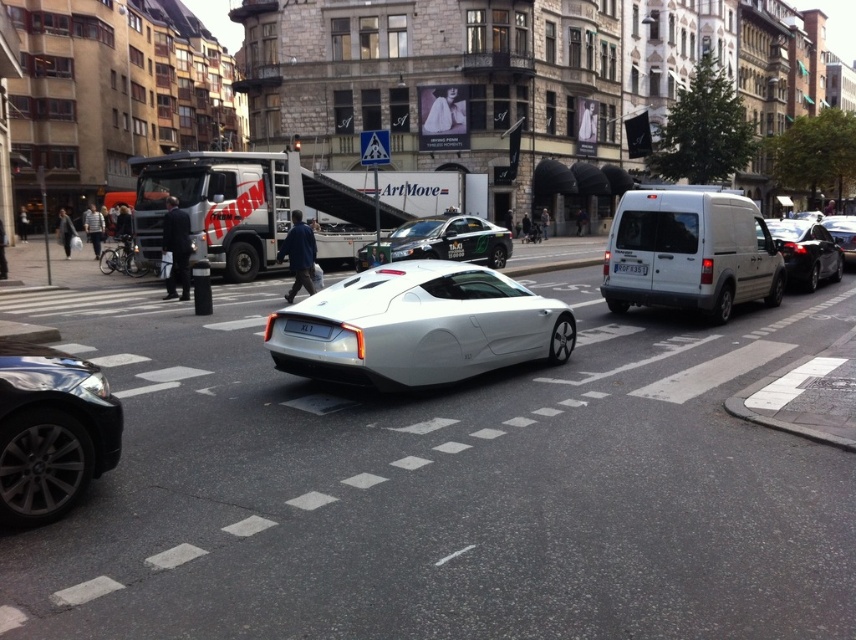
Question: Where is white matte sports car at center located in relation to sleek silver car at lower left in the image?

Choices:
 (A) left
 (B) right

Answer: (B)

Question: Which point is closer to the camera taking this photo?

Choices:
 (A) (635, 266)
 (B) (79, 497)

Answer: (B)

Question: Which is nearer to the white matte van at right?

Choices:
 (A) sleek silver car at lower left
 (B) white matte sports car at center
 (C) metallic silver car at center

Answer: (B)

Question: Does white matte van at right appear on the left side of sleek silver car at lower left?

Choices:
 (A) no
 (B) yes

Answer: (A)

Question: Which point is closer to the camera?

Choices:
 (A) white matte sports car at center
 (B) shiny black car at right
 (C) white plastic license plate at center
 (D) white matte van at right

Answer: (A)

Question: Is white matte van at right to the right of sleek silver car at lower left from the viewer's perspective?

Choices:
 (A) no
 (B) yes

Answer: (B)